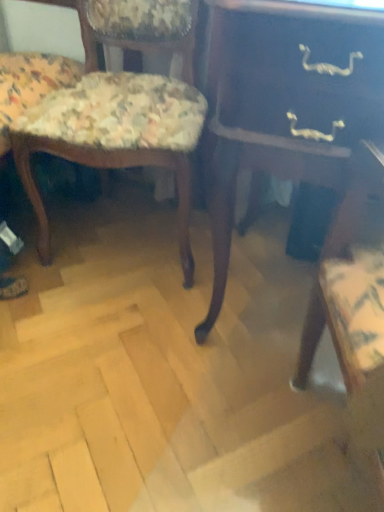
Describe the element at coordinates (80, 28) in the screenshot. I see `floral fabric chair at left, the second chair in the right-to-left sequence` at that location.

The image size is (384, 512). In order to click on dark wood table at center in this screenshot , I will do `click(285, 103)`.

Between point (111, 23) and point (342, 69), which one is positioned behind?

The point (111, 23) is behind.

Is floral fabric chair at left, the 2th chair positioned from the left, positioned with its back to dark wood table at center?

floral fabric chair at left, the 2th chair positioned from the left, does not have its back to dark wood table at center.

In the scene shown: From the image's perspective, is floral fabric chair at left, acting as the 1th chair starting from the right, located above or below dark wood table at center?

From the image's perspective, floral fabric chair at left, acting as the 1th chair starting from the right, appears above dark wood table at center.

Considering the relative sizes of floral fabric chair at left, which appears as the 1th chair when viewed from the left, and floral fabric chair at left, the 2th chair positioned from the left, in the image provided, is floral fabric chair at left, which appears as the 1th chair when viewed from the left, taller than floral fabric chair at left, the 2th chair positioned from the left,?

In fact, floral fabric chair at left, which appears as the 1th chair when viewed from the left, may be shorter than floral fabric chair at left, the 2th chair positioned from the left.

From the image's perspective, would you say floral fabric chair at left, the second chair in the right-to-left sequence, is positioned over floral fabric chair at left, the 2th chair positioned from the left?

Yes, from the image's perspective, floral fabric chair at left, the second chair in the right-to-left sequence, is over floral fabric chair at left, the 2th chair positioned from the left.

From a real-world perspective, is floral fabric chair at left, the second chair in the right-to-left sequence, positioned above or below floral fabric chair at left, the 2th chair positioned from the left?

floral fabric chair at left, the second chair in the right-to-left sequence, is situated lower than floral fabric chair at left, the 2th chair positioned from the left, in the real world.

Consider the image. Considering the relative sizes of floral fabric chair at left, which appears as the 1th chair when viewed from the left, and floral fabric chair at left, the 2th chair positioned from the left, in the image provided, is floral fabric chair at left, which appears as the 1th chair when viewed from the left, bigger than floral fabric chair at left, the 2th chair positioned from the left,?

Correct, floral fabric chair at left, which appears as the 1th chair when viewed from the left, is larger in size than floral fabric chair at left, the 2th chair positioned from the left.

Is the position of dark wood table at center less distant than that of floral fabric chair at left, acting as the 1th chair starting from the right?

Yes, dark wood table at center is closer to the camera.

Considering the relative positions of dark wood table at center and floral fabric chair at left, the 2th chair positioned from the left, in the image provided, is dark wood table at center to the right of floral fabric chair at left, the 2th chair positioned from the left, from the viewer's perspective?

Yes.

Which is nearer, (327, 142) or (188, 54)?

The point (327, 142) is closer.

Between dark wood table at center and floral fabric chair at left, acting as the 1th chair starting from the right, which one has more height?

With more height is dark wood table at center.

Looking at this image, are floral fabric chair at left, which appears as the 1th chair when viewed from the left, and dark wood table at center making contact?

No, floral fabric chair at left, which appears as the 1th chair when viewed from the left, is not making contact with dark wood table at center.

Which is more to the right, floral fabric chair at left, the second chair in the right-to-left sequence, or dark wood table at center?

From the viewer's perspective, dark wood table at center appears more on the right side.

Is floral fabric chair at left, the second chair in the right-to-left sequence, bigger than dark wood table at center?

Yes.

Does floral fabric chair at left, the second chair in the right-to-left sequence, have a lesser height compared to dark wood table at center?

Correct, floral fabric chair at left, the second chair in the right-to-left sequence, is not as tall as dark wood table at center.

From the image's perspective, which one is positioned higher, dark wood table at center or floral fabric chair at left, which appears as the 1th chair when viewed from the left?

floral fabric chair at left, which appears as the 1th chair when viewed from the left, appears higher in the image.

Which object is positioned more to the right, dark wood table at center or floral fabric chair at left, the second chair in the right-to-left sequence?

Positioned to the right is dark wood table at center.

Considering the relative sizes of dark wood table at center and floral fabric chair at left, which appears as the 1th chair when viewed from the left, in the image provided, is dark wood table at center shorter than floral fabric chair at left, which appears as the 1th chair when viewed from the left,?

No, dark wood table at center is not shorter than floral fabric chair at left, which appears as the 1th chair when viewed from the left.

Considering the points (53, 138) and (52, 5), which point is in front, point (53, 138) or point (52, 5)?

The point (53, 138) is closer.

Is floral fabric chair at left, acting as the 1th chair starting from the right, facing towards floral fabric chair at left, which appears as the 1th chair when viewed from the left?

No.

Does floral fabric chair at left, the 2th chair positioned from the left, have a larger size compared to floral fabric chair at left, which appears as the 1th chair when viewed from the left?

No, floral fabric chair at left, the 2th chair positioned from the left, is not bigger than floral fabric chair at left, which appears as the 1th chair when viewed from the left.

Is floral fabric chair at left, the 2th chair positioned from the left, with floral fabric chair at left, which appears as the 1th chair when viewed from the left?

floral fabric chair at left, the 2th chair positioned from the left, is not next to floral fabric chair at left, which appears as the 1th chair when viewed from the left, and they're not touching.

Identify the location of table above the floral fabric chair at left, the 2th chair positioned from the left (from a real-world perspective). (285, 103).

Identify the location of chair that appears in front of the floral fabric chair at left, acting as the 1th chair starting from the right. (80, 28).

Looking at this image, when comparing their distances from floral fabric chair at left, the second chair in the right-to-left sequence, does dark wood table at center or floral fabric chair at left, the 2th chair positioned from the left, seem further?

dark wood table at center.

Considering their positions, is floral fabric chair at left, which appears as the 1th chair when viewed from the left, positioned closer to dark wood table at center than floral fabric chair at left, acting as the 1th chair starting from the right?

floral fabric chair at left, acting as the 1th chair starting from the right, lies closer to dark wood table at center than the other object.

When comparing their distances from floral fabric chair at left, which appears as the 1th chair when viewed from the left, does floral fabric chair at left, the 2th chair positioned from the left, or dark wood table at center seem closer?

floral fabric chair at left, the 2th chair positioned from the left.

Considering their positions, is dark wood table at center positioned closer to floral fabric chair at left, acting as the 1th chair starting from the right, than floral fabric chair at left, which appears as the 1th chair when viewed from the left?

floral fabric chair at left, which appears as the 1th chair when viewed from the left, is positioned closer to the anchor floral fabric chair at left, acting as the 1th chair starting from the right.

Considering their positions, is floral fabric chair at left, acting as the 1th chair starting from the right, positioned further to dark wood table at center than floral fabric chair at left, which appears as the 1th chair when viewed from the left?

The object further to dark wood table at center is floral fabric chair at left, which appears as the 1th chair when viewed from the left.

Which object lies nearer to the anchor point floral fabric chair at left, the 2th chair positioned from the left, floral fabric chair at left, the second chair in the right-to-left sequence, or dark wood table at center?

Based on the image, floral fabric chair at left, the second chair in the right-to-left sequence, appears to be nearer to floral fabric chair at left, the 2th chair positioned from the left.

Identify the location of chair between floral fabric chair at left, the second chair in the right-to-left sequence, and dark wood table at center, in the horizontal direction. The image size is (384, 512). (113, 105).